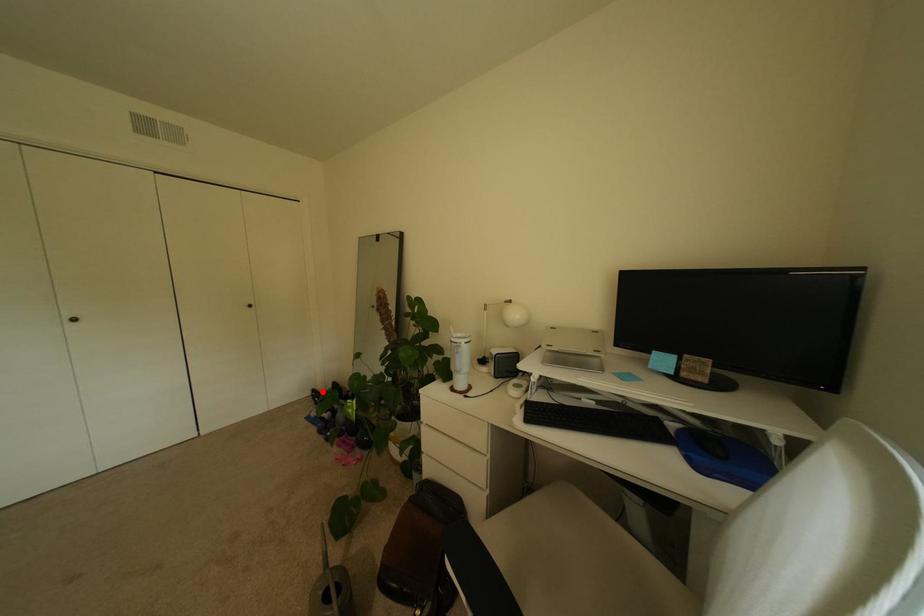
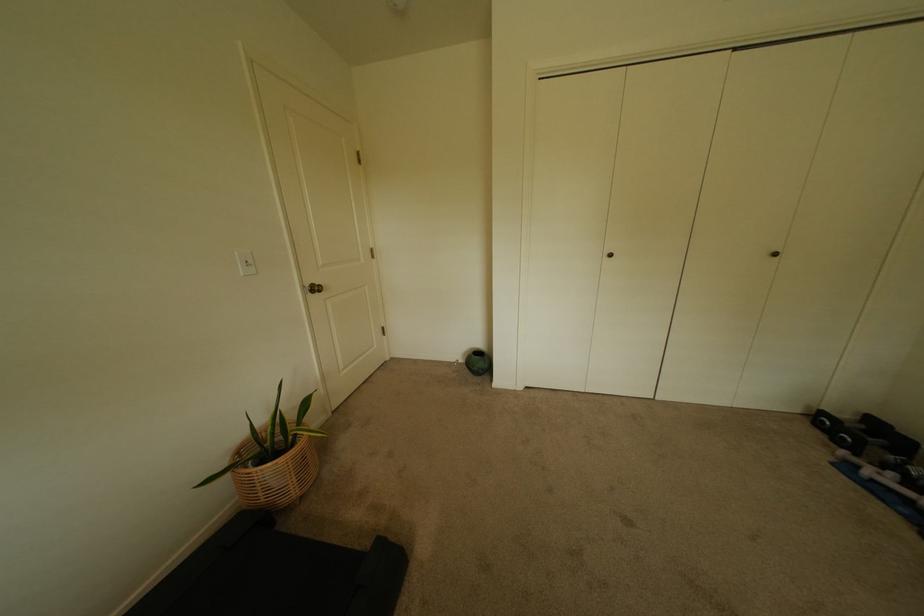
Question: I am providing you with two images of the same scene from different viewpoints. In image1, a red point is highlighted. Considering the same 3D point in image2, which of the following is correct?

Choices:
 (A) It is closer
 (B) It is farther

Answer: (A)